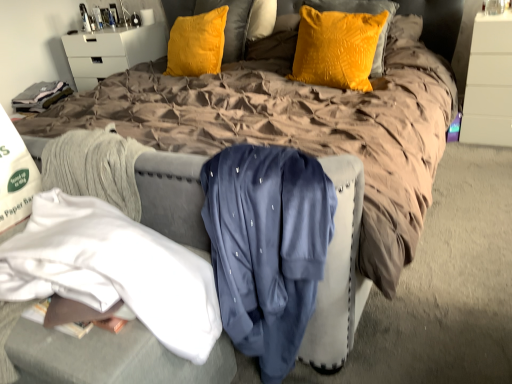
Question: Should I look upward or downward to see navy blue satin shirt at center, which appears as the first clothing when viewed from the right?

Choices:
 (A) down
 (B) up

Answer: (A)

Question: Could you tell me if velvet yellow pillow at upper center, the second pillow viewed from the left, is facing brown quilted bed at center?

Choices:
 (A) yes
 (B) no

Answer: (A)

Question: Can you confirm if velvet yellow pillow at upper center, the second pillow viewed from the left, is bigger than brown quilted bed at center?

Choices:
 (A) yes
 (B) no

Answer: (B)

Question: Can you confirm if velvet yellow pillow at upper center, which is the 2th pillow in back-to-front order, is wider than brown quilted bed at center?

Choices:
 (A) no
 (B) yes

Answer: (A)

Question: Is velvet yellow pillow at upper center, the second pillow viewed from the left, to the right of brown quilted bed at center from the viewer's perspective?

Choices:
 (A) no
 (B) yes

Answer: (B)

Question: From a real-world perspective, is velvet yellow pillow at upper center, which appears as the first pillow when viewed from the front, on top of brown quilted bed at center?

Choices:
 (A) no
 (B) yes

Answer: (B)

Question: From a real-world perspective, is velvet yellow pillow at upper center, the second pillow viewed from the left, under brown quilted bed at center?

Choices:
 (A) no
 (B) yes

Answer: (A)

Question: Is brown quilted bed at center in contact with white fabric at lower left, which ranks as the 1th clothing in left-to-right order?

Choices:
 (A) yes
 (B) no

Answer: (B)

Question: From the image's perspective, is brown quilted bed at center on top of white fabric at lower left, the 2th clothing positioned from the right?

Choices:
 (A) yes
 (B) no

Answer: (A)

Question: Considering the relative sizes of brown quilted bed at center and white fabric at lower left, which ranks as the 1th clothing in left-to-right order, in the image provided, is brown quilted bed at center bigger than white fabric at lower left, which ranks as the 1th clothing in left-to-right order,?

Choices:
 (A) yes
 (B) no

Answer: (A)

Question: Can you confirm if brown quilted bed at center is smaller than white fabric at lower left, the 2th clothing positioned from the right?

Choices:
 (A) yes
 (B) no

Answer: (B)

Question: Is brown quilted bed at center completely or partially outside of white fabric at lower left, the 2th clothing positioned from the right?

Choices:
 (A) no
 (B) yes

Answer: (B)

Question: Can you confirm if brown quilted bed at center is shorter than white fabric at lower left, the 2th clothing positioned from the right?

Choices:
 (A) yes
 (B) no

Answer: (B)

Question: Is white glossy dresser at upper right with velvet yellow pillow at center, which is the second pillow from front to back?

Choices:
 (A) yes
 (B) no

Answer: (B)